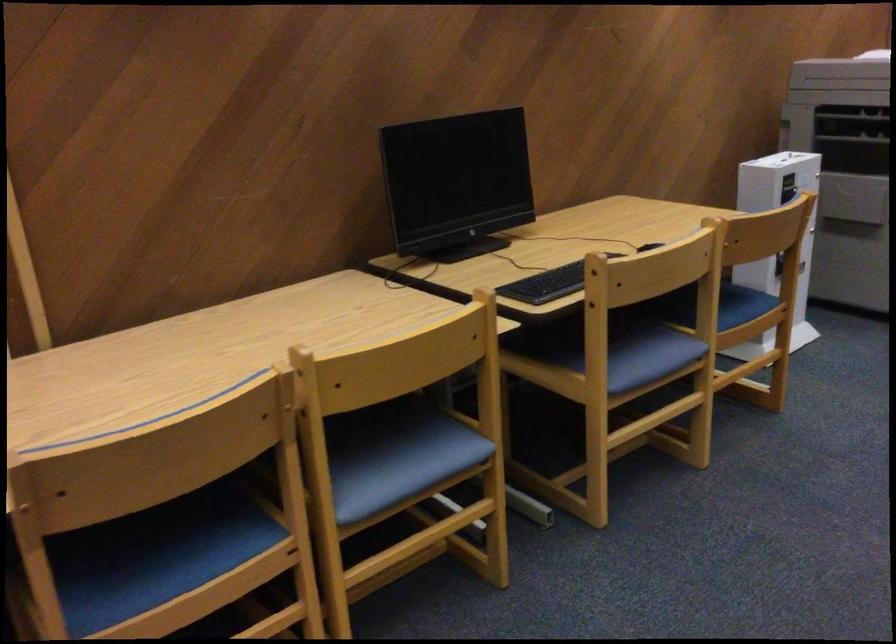
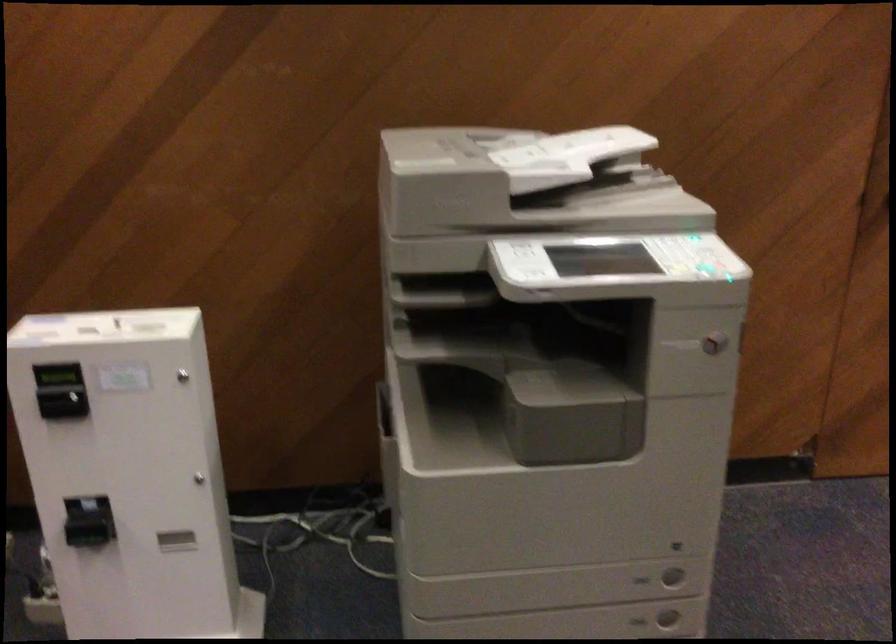
Find the pixel in the second image that matches point (816, 165) in the first image.

(183, 375)